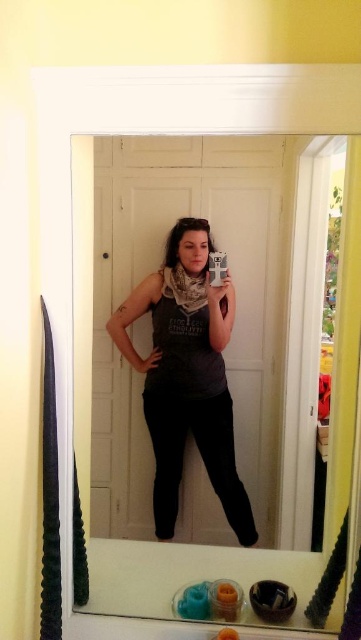
You are standing in the bathroom and want to reach two points on the mirror. The first point is at coordinate point (309, 557) and the second is at point (237, 515). Which point is closer to your current position?

Point (309, 557) is closer to the camera than point (237, 515), so the first point is closer to your current position.

You are a photographer trying to capture a closeup of the clear glass mirror at center and the matte gray tank top at center in the bathroom scene. Given that your camera can only focus on objects within 3 inches of each other, will you be able to get both in focus?

The clear glass mirror at center and matte gray tank top at center are 3.52 inches apart from each other. Since the distance between them exceeds the 3 inches focus range, the camera cannot focus on both simultaneously.

Based on the photo, you are trying to hang a rectangular picture frame that is 15 inches wide. You have two options to place it either on the clear glass mirror at center or on the matte gray tank top at center. Based on their widths, which object can definitely fit the frame without overlapping the edges?

The clear glass mirror at center is wider than the matte gray tank top at center, so the frame can definitely fit on the clear glass mirror at center without overlapping the edges.